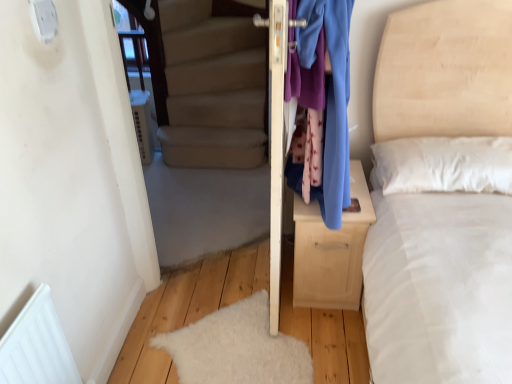
Question: From the image's perspective, is blue fabric at right on top of light wood/texture nightstand at center?

Choices:
 (A) yes
 (B) no

Answer: (A)

Question: Does blue fabric at right have a greater height compared to light wood/texture nightstand at center?

Choices:
 (A) no
 (B) yes

Answer: (B)

Question: From the image's perspective, does blue fabric at right appear lower than light wood/texture nightstand at center?

Choices:
 (A) yes
 (B) no

Answer: (B)

Question: Does blue fabric at right come behind light wood/texture nightstand at center?

Choices:
 (A) yes
 (B) no

Answer: (B)

Question: Is blue fabric at right not close to light wood/texture nightstand at center?

Choices:
 (A) no
 (B) yes

Answer: (A)

Question: From a real-world perspective, is blue fabric at right physically located above or below light wood/texture nightstand at center?

Choices:
 (A) below
 (B) above

Answer: (B)

Question: Is blue fabric at right inside the boundaries of light wood/texture nightstand at center, or outside?

Choices:
 (A) inside
 (B) outside

Answer: (B)

Question: In the image, is blue fabric at right positioned in front of or behind light wood/texture nightstand at center?

Choices:
 (A) front
 (B) behind

Answer: (A)

Question: Does point (307, 57) appear closer or farther from the camera than point (343, 269)?

Choices:
 (A) closer
 (B) farther

Answer: (A)

Question: Relative to light wood/texture nightstand at center, is white fluffy mat at lower left in front or behind?

Choices:
 (A) behind
 (B) front

Answer: (A)

Question: Considering the positions of white fluffy mat at lower left and light wood/texture nightstand at center in the image, is white fluffy mat at lower left wider or thinner than light wood/texture nightstand at center?

Choices:
 (A) wide
 (B) thin

Answer: (A)

Question: Is white fluffy mat at lower left inside or outside of light wood/texture nightstand at center?

Choices:
 (A) outside
 (B) inside

Answer: (A)

Question: Considering the positions of white fluffy mat at lower left and light wood/texture nightstand at center in the image, is white fluffy mat at lower left bigger or smaller than light wood/texture nightstand at center?

Choices:
 (A) big
 (B) small

Answer: (B)

Question: From their relative heights in the image, would you say light wood/texture nightstand at center is taller or shorter than white fluffy mat at lower left?

Choices:
 (A) tall
 (B) short

Answer: (A)

Question: Considering the positions of light wood/texture nightstand at center and white fluffy mat at lower left in the image, is light wood/texture nightstand at center bigger or smaller than white fluffy mat at lower left?

Choices:
 (A) small
 (B) big

Answer: (B)